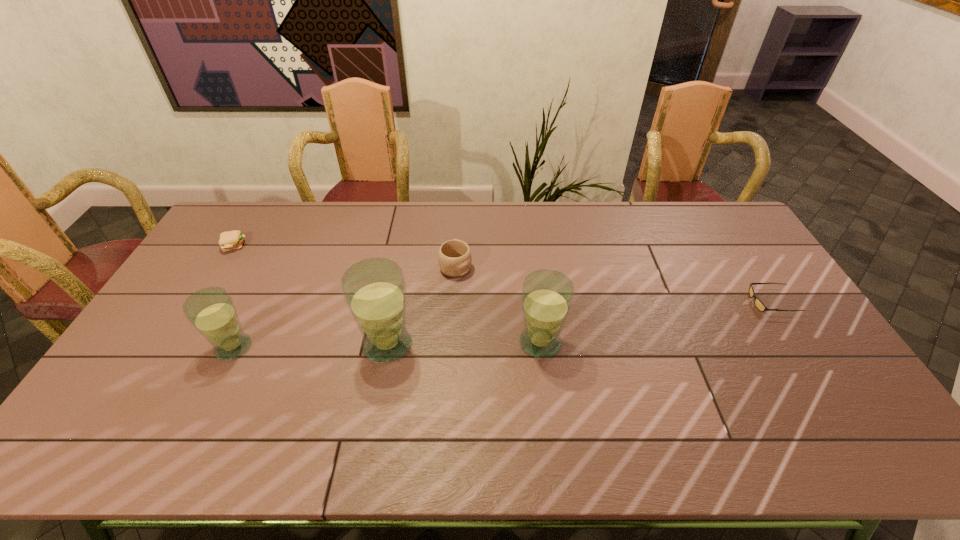
Image resolution: width=960 pixels, height=540 pixels. What are the coordinates of `the closest glass to the second glass from left to right` in the screenshot? It's located at (547, 295).

Locate which glass is the closest to the sunglasses. Please provide its 2D coordinates. Your answer should be formatted as a tuple, i.e. [(x, y)], where the tuple contains the x and y coordinates of a point satisfying the conditions above.

[(547, 295)]